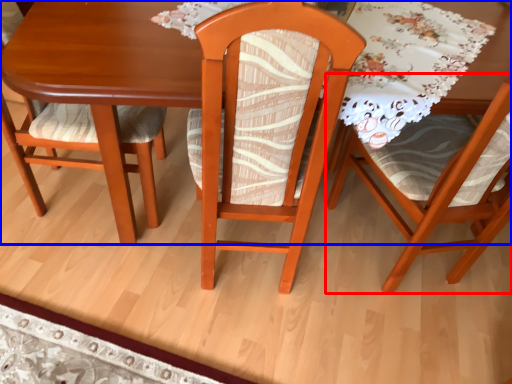
Question: Which of the following is the closest to the observer, chair (highlighted by a red box) or table (highlighted by a blue box)?

Choices:
 (A) chair
 (B) table

Answer: (A)